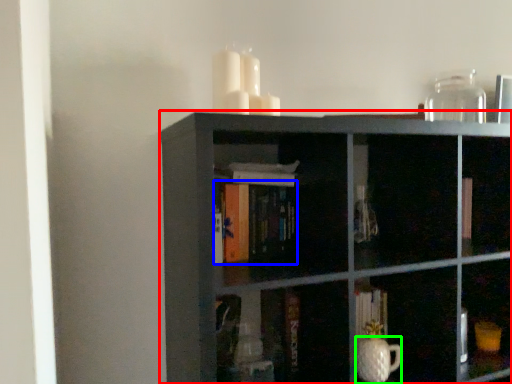
Question: Which object is positioned closest to shelf (highlighted by a red box)? Select from book (highlighted by a blue box) and glass vase (highlighted by a green box).

Choices:
 (A) book
 (B) glass vase

Answer: (A)